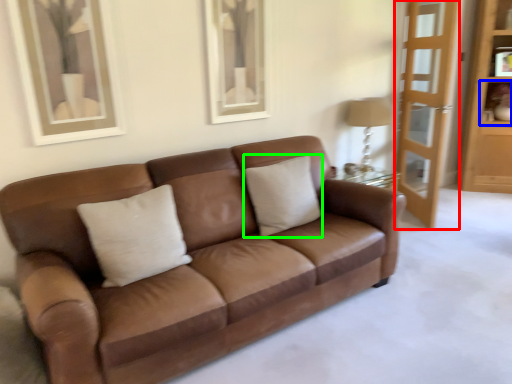
Question: Which is nearer to the screen door (highlighted by a red box)? shelf (highlighted by a blue box) or pillow (highlighted by a green box).

Choices:
 (A) shelf
 (B) pillow

Answer: (A)